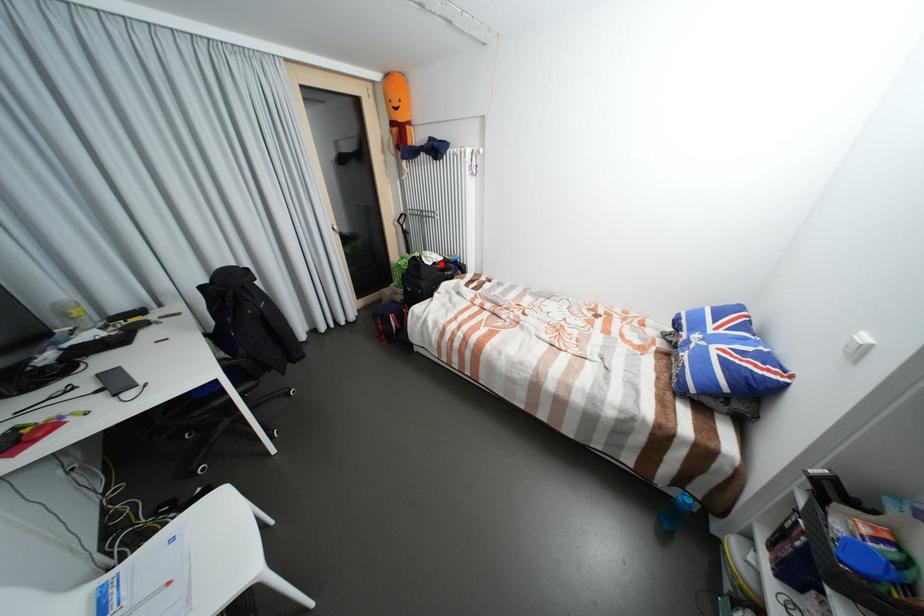
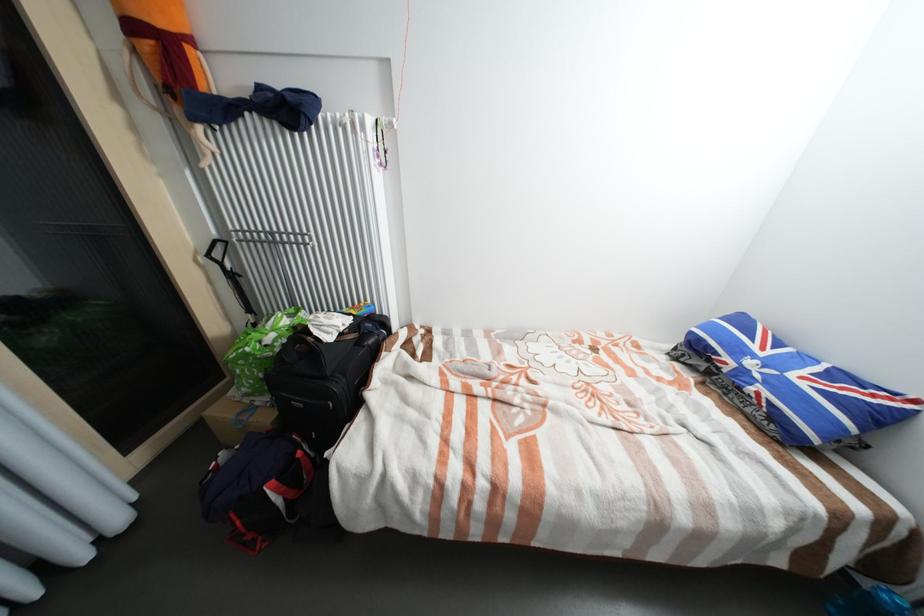
Where in the second image is the point corresponding to the highlighted location from the first image?

(348, 334)